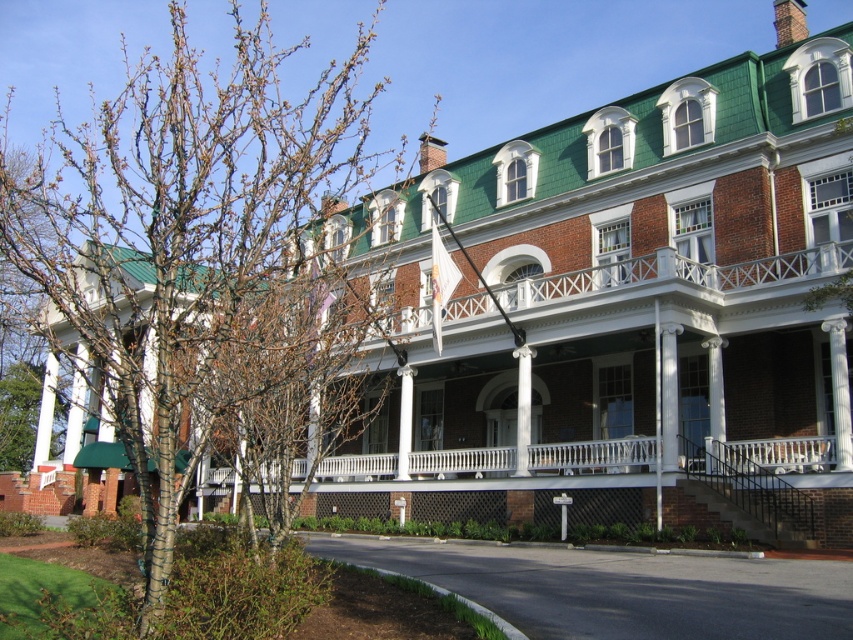
Does bare branches at left appear over white smooth column at center?

Yes.

This screenshot has width=853, height=640. Find the location of `bare branches at left`. bare branches at left is located at coordinates (194, 252).

Between white painted wood porch at center and bare wood tree at center, which one appears on the right side from the viewer's perspective?

From the viewer's perspective, white painted wood porch at center appears more on the right side.

This screenshot has height=640, width=853. I want to click on white painted wood porch at center, so click(x=593, y=456).

Locate an element on the screen. This screenshot has height=640, width=853. white painted wood porch at center is located at coordinates (593, 456).

Does white painted wood porch at center have a larger size compared to white smooth column at center?

Yes, white painted wood porch at center is bigger than white smooth column at center.

Between white painted wood porch at center and white smooth column at center, which one has more height?

Standing taller between the two is white smooth column at center.

Image resolution: width=853 pixels, height=640 pixels. What do you see at coordinates (593, 456) in the screenshot?
I see `white painted wood porch at center` at bounding box center [593, 456].

Locate an element on the screen. The image size is (853, 640). white painted wood porch at center is located at coordinates (593, 456).